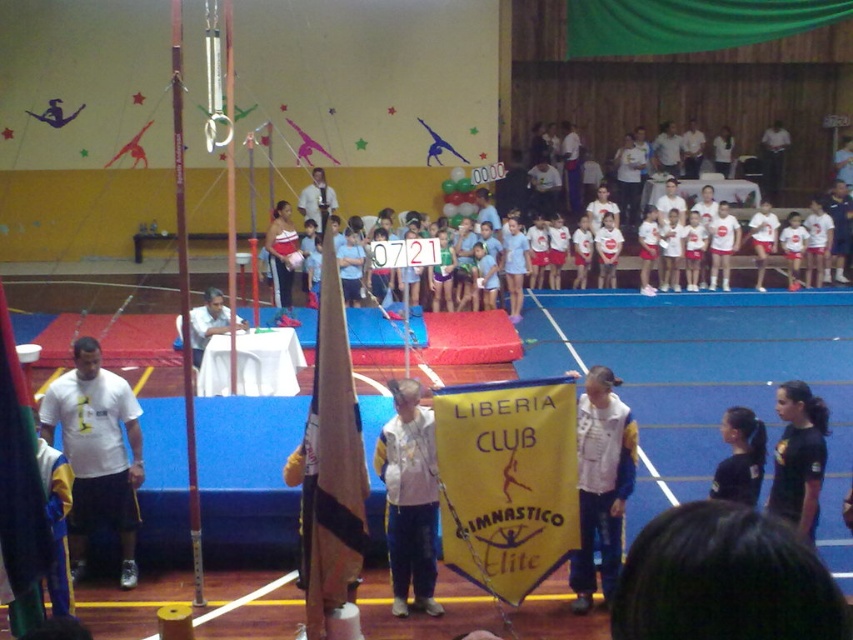
Who is more forward, (109, 371) or (287, 218)?

Point (109, 371) is more forward.

Does white matte t-shirt at center have a greater width compared to matte white tank top at center?

Correct, the width of white matte t-shirt at center exceeds that of matte white tank top at center.

The image size is (853, 640). Identify the location of white matte t-shirt at center. (97, 452).

Between white matte t-shirt at center and black fabric hair at lower right, which one is positioned lower?

Positioned lower is white matte t-shirt at center.

Describe the element at coordinates (97, 452) in the screenshot. I see `white matte t-shirt at center` at that location.

Between point (80, 538) and point (756, 428), which one is positioned behind?

Point (80, 538)

The height and width of the screenshot is (640, 853). In order to click on white matte t-shirt at center in this screenshot , I will do `click(97, 452)`.

What do you see at coordinates (409, 499) in the screenshot? I see `white/yellow jacket at center` at bounding box center [409, 499].

Looking at this image, is white/yellow jacket at center thinner than white fabric at center?

Indeed, white/yellow jacket at center has a lesser width compared to white fabric at center.

Which is behind, point (422, 563) or point (207, 300)?

The point (207, 300) is more distant.

This screenshot has height=640, width=853. Identify the location of white/yellow jacket at center. (409, 499).